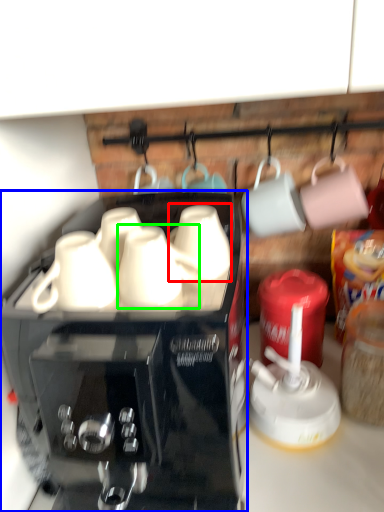
Question: Which object is positioned farthest from mug (highlighted by a red box)? Select from coffee maker (highlighted by a blue box) and mug (highlighted by a green box).

Choices:
 (A) coffee maker
 (B) mug

Answer: (A)